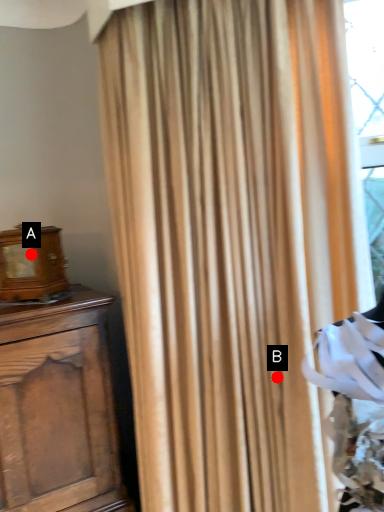
Question: Two points are circled on the image, labeled by A and B beside each circle. Which of the following is the farthest from the observer?

Choices:
 (A) A is further
 (B) B is further

Answer: (A)